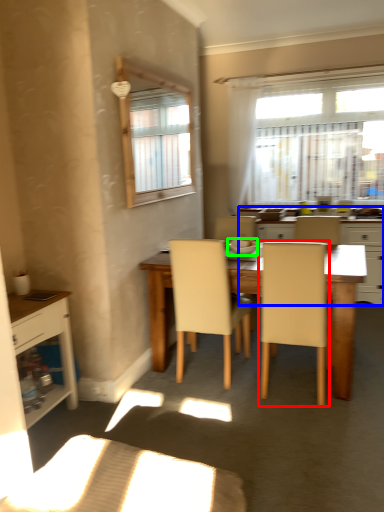
Question: Which is nearer to the chair (highlighted by a red box)? kitchen & dining room table (highlighted by a blue box) or tableware (highlighted by a green box).

Choices:
 (A) kitchen & dining room table
 (B) tableware

Answer: (B)